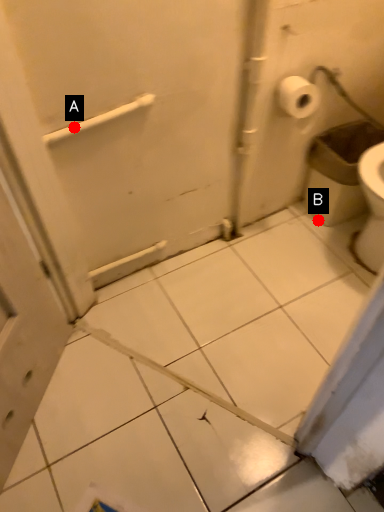
Question: Two points are circled on the image, labeled by A and B beside each circle. Which of the following is the farthest from the observer?

Choices:
 (A) A is further
 (B) B is further

Answer: (B)